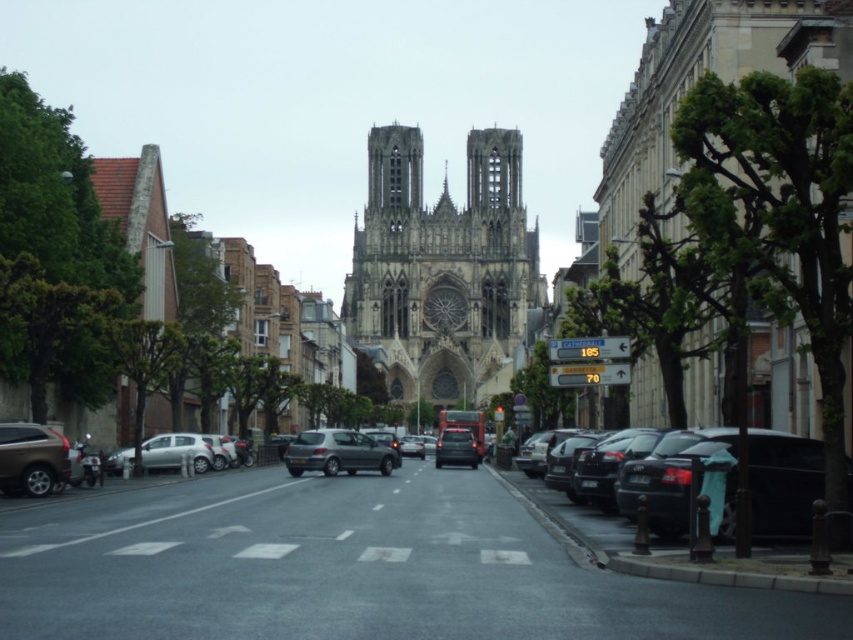
Question: Does stone gothic cathedral at center lie behind dark gray metallic car at right?

Choices:
 (A) yes
 (B) no

Answer: (A)

Question: Can you confirm if satin silver hatchback at center is bigger than matte black car at center?

Choices:
 (A) yes
 (B) no

Answer: (A)

Question: Which object is the farthest from the matte black car at center?

Choices:
 (A) dark gray metallic car at right
 (B) satin silver hatchback at center

Answer: (A)

Question: Which of these objects is positioned closest to the matte black car at center?

Choices:
 (A) satin silver hatchback at center
 (B) matte brown suv at lower left
 (C) stone gothic cathedral at center
 (D) dark gray metallic car at right

Answer: (A)

Question: Is satin silver hatchback at center closer to the viewer compared to matte black car at center?

Choices:
 (A) yes
 (B) no

Answer: (A)

Question: Which point is closer to the camera taking this photo?

Choices:
 (A) (724, 428)
 (B) (4, 436)
 (C) (451, 460)
 (D) (433, 252)

Answer: (A)